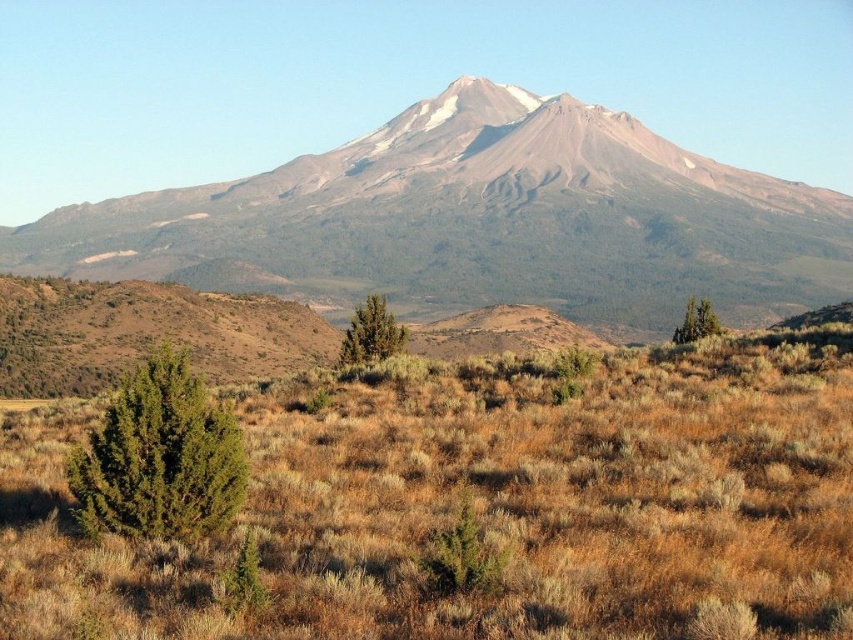
In the scene shown: Does brown dry grass at center appear over green matte tree at center-right?

Actually, brown dry grass at center is below green matte tree at center-right.

Can you confirm if brown dry grass at center is wider than green matte tree at center-right?

In fact, brown dry grass at center might be narrower than green matte tree at center-right.

Does point (799, 557) come farther from viewer compared to point (695, 314)?

No.

Identify the location of brown dry grass at center. (485, 506).

Is gray rocky mountain range at upper center thinner than green textured bush at lower left?

No.

Is point (621, 228) closer to camera compared to point (151, 484)?

No, (621, 228) is further to viewer.

Does point (749, 266) come behind point (225, 467)?

Yes, point (749, 266) is farther from viewer.

Identify the location of gray rocky mountain range at upper center. (479, 221).

Is gray rocky mountain range at upper center bigger than green matte tree at center?

Indeed, gray rocky mountain range at upper center has a larger size compared to green matte tree at center.

Does point (646, 141) come closer to viewer compared to point (375, 320)?

No, (646, 141) is behind (375, 320).

Is point (407, 168) positioned after point (379, 346)?

That is True.

Where is `gray rocky mountain range at upper center`? The width and height of the screenshot is (853, 640). gray rocky mountain range at upper center is located at coordinates (479, 221).